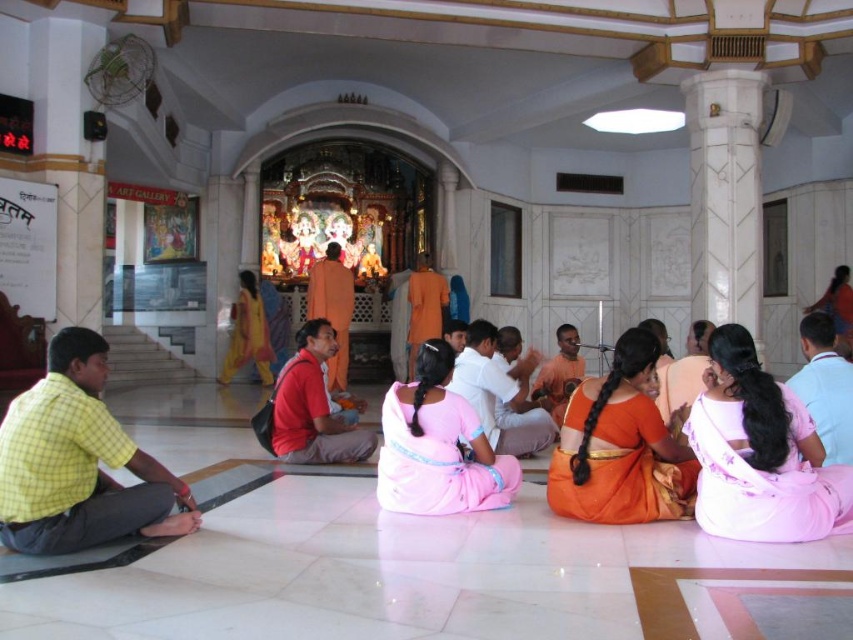
Question: Does red matte shirt at center have a greater width compared to light blue shirt at lower right?

Choices:
 (A) no
 (B) yes

Answer: (A)

Question: Which of the following is the farthest from the observer?

Choices:
 (A) (561, 323)
 (B) (555, 499)
 (C) (38, 518)

Answer: (A)

Question: Is pink silk saree at center further to camera compared to white cotton shirt at center?

Choices:
 (A) no
 (B) yes

Answer: (A)

Question: Considering the real-world distances, which object is closest to the orange cloth at center?

Choices:
 (A) red matte shirt at center
 (B) yellow checkered shirt at left
 (C) light blue shirt at lower right

Answer: (A)

Question: Can you confirm if light blue shirt at lower right is positioned below orange cloth at center?

Choices:
 (A) yes
 (B) no

Answer: (A)

Question: Which of these objects is positioned closest to the orange clothed man at center?

Choices:
 (A) orange silk saree at center
 (B) light blue shirt at lower right

Answer: (B)